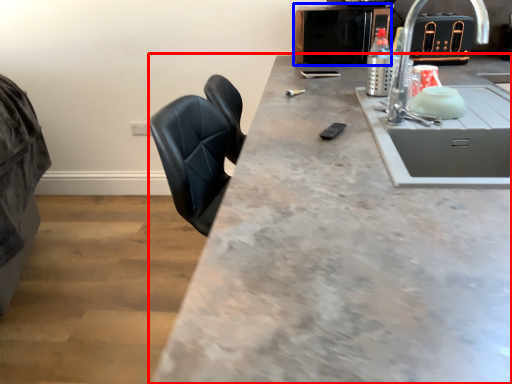
Question: Which point is closer to the camera, countertop (highlighted by a red box) or appliance (highlighted by a blue box)?

Choices:
 (A) countertop
 (B) appliance

Answer: (A)